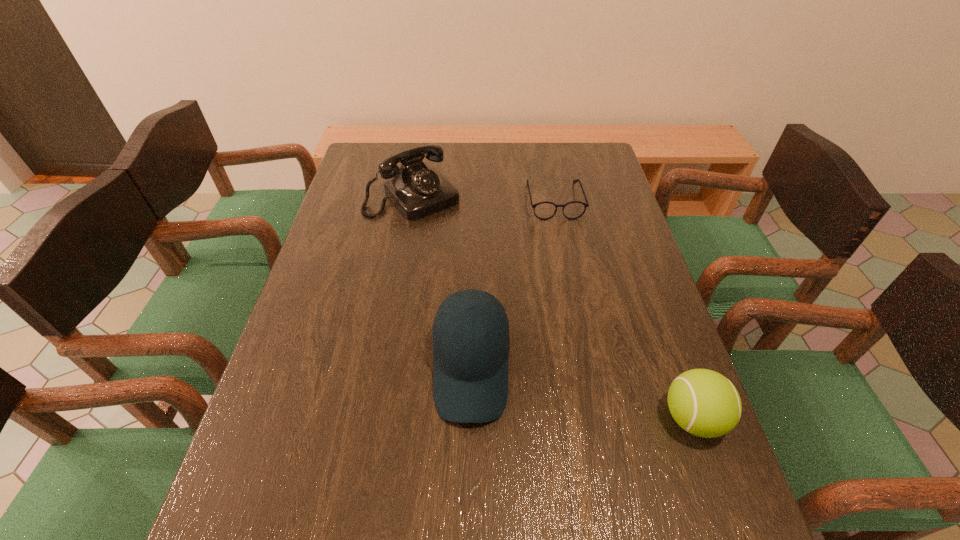
Locate an element on the screen. This screenshot has height=540, width=960. object positioned at the near right corner is located at coordinates (705, 403).

Find the location of a particular element. vacant area at the far edge of the desktop is located at coordinates (512, 159).

You are a GUI agent. You are given a task and a screenshot of the screen. Output one action in this format:
    pyautogui.click(x=<x>, y=<y>)
    Task: Click on the vacant space at the near edge
    The image size is (960, 540).
    Given the screenshot: What is the action you would take?
    pyautogui.click(x=453, y=453)

The width and height of the screenshot is (960, 540). Find the location of `free region at the left edge of the desktop`. free region at the left edge of the desktop is located at coordinates (310, 420).

Where is `free space at the right edge`? free space at the right edge is located at coordinates (623, 406).

Find the location of `free spot at the far left corner of the desktop`. free spot at the far left corner of the desktop is located at coordinates (373, 175).

The image size is (960, 540). In order to click on free space at the far right corner of the desktop in this screenshot , I will do `click(566, 176)`.

You are a GUI agent. You are given a task and a screenshot of the screen. Output one action in this format:
    pyautogui.click(x=<x>, y=<y>)
    Task: Click on the vacant space at the near right corner
    The height and width of the screenshot is (540, 960).
    Given the screenshot: What is the action you would take?
    pyautogui.click(x=678, y=455)

Locate an element on the screen. vacant space that is in between the baseball cap and the telephone is located at coordinates (442, 282).

Locate an element on the screen. The height and width of the screenshot is (540, 960). empty space between the telephone and the baseball cap is located at coordinates (442, 282).